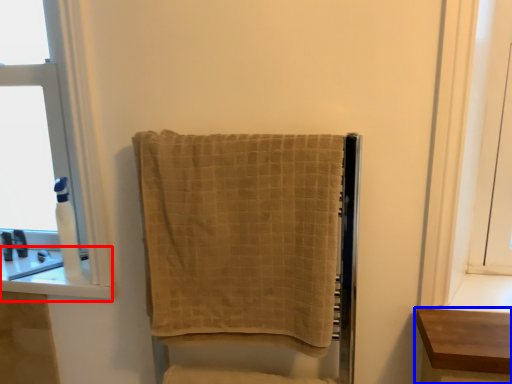
Question: Which point is closer to the camera, window sill (highlighted by a red box) or furniture (highlighted by a blue box)?

Choices:
 (A) window sill
 (B) furniture

Answer: (B)